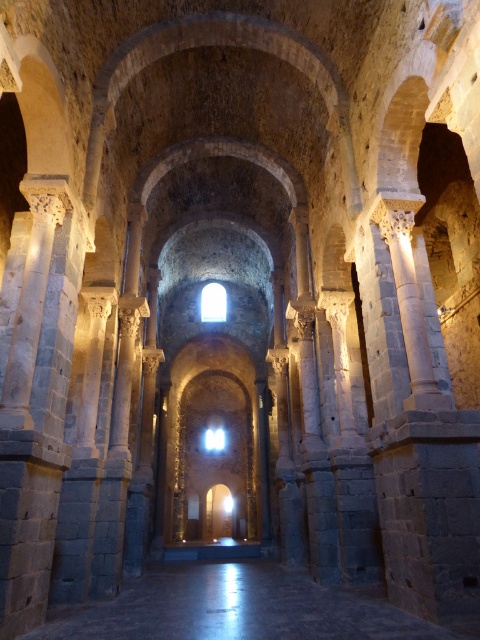
The height and width of the screenshot is (640, 480). I want to click on dark stone floor at center, so click(240, 609).

The width and height of the screenshot is (480, 640). Find the location of `dark stone floor at center`. dark stone floor at center is located at coordinates (240, 609).